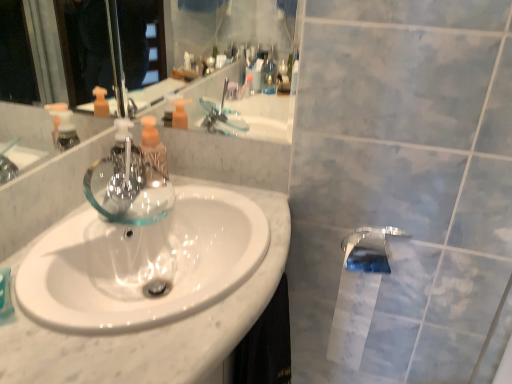
I want to click on free space in front of translucent plastic soap dispenser at center, so click(x=128, y=218).